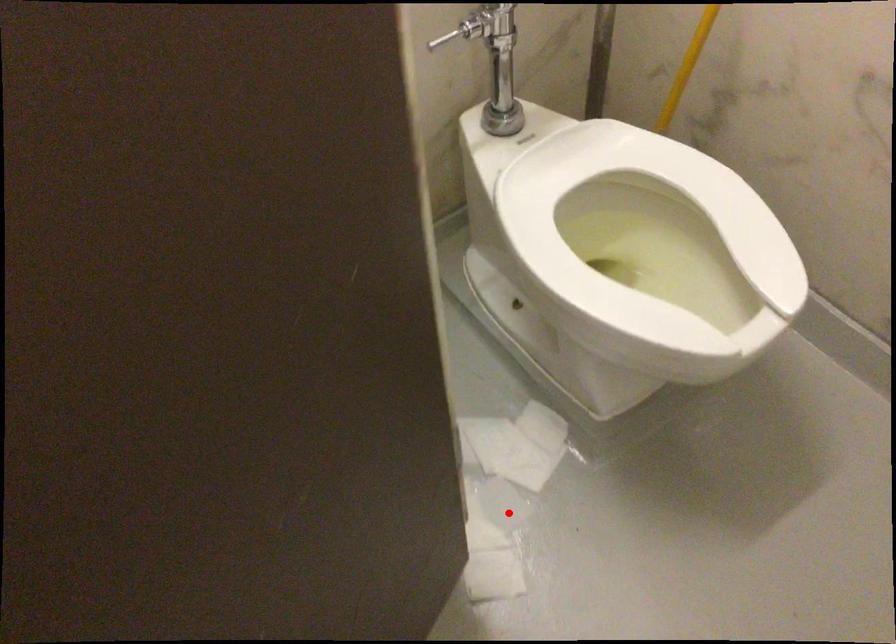
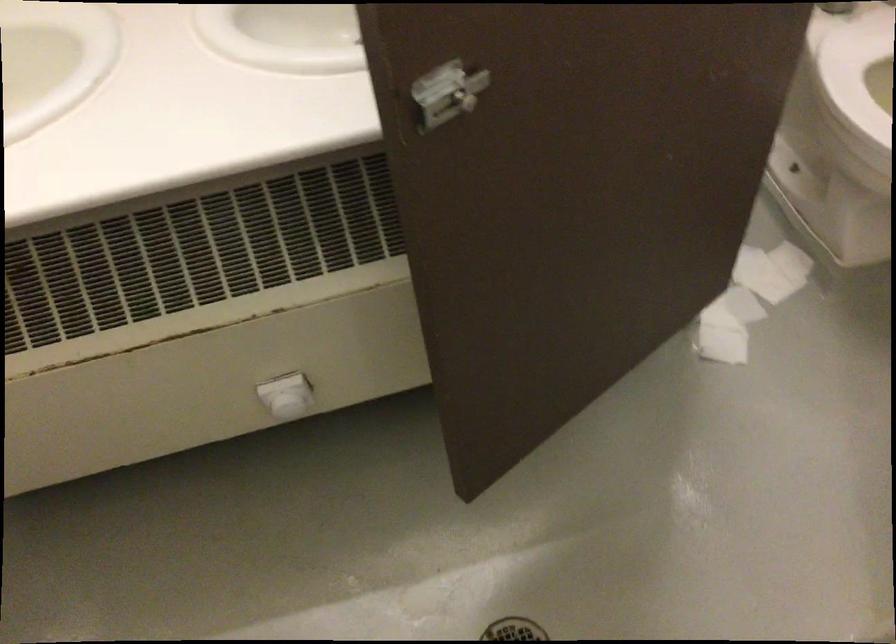
Where in the second image is the point corresponding to the highlighted location from the first image?

(739, 305)